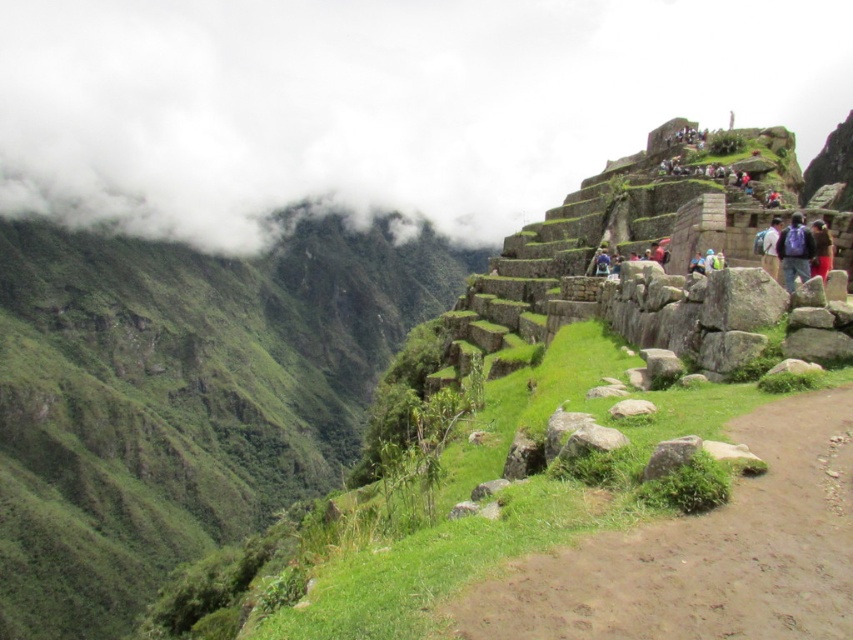
Question: Which of the following is the farthest from the observer?

Choices:
 (A) blue backpack at upper right
 (B) dark brown leather jacket at right
 (C) brown dirt path at center

Answer: (B)

Question: Is brown dirt path at center to the right of dark brown leather jacket at right from the viewer's perspective?

Choices:
 (A) yes
 (B) no

Answer: (B)

Question: Which of the following is the closest to the observer?

Choices:
 (A) dark brown leather jacket at right
 (B) blue backpack at center-right

Answer: (A)

Question: In this image, where is white fluffy cloud at upper left located relative to brown dirt path at center?

Choices:
 (A) right
 (B) left

Answer: (A)

Question: Which point appears farthest from the camera in this image?

Choices:
 (A) (624, 413)
 (B) (782, 253)
 (C) (463, 214)
 (D) (825, 230)

Answer: (C)

Question: Does brown dirt path at center come in front of blue backpack at center-right?

Choices:
 (A) yes
 (B) no

Answer: (A)